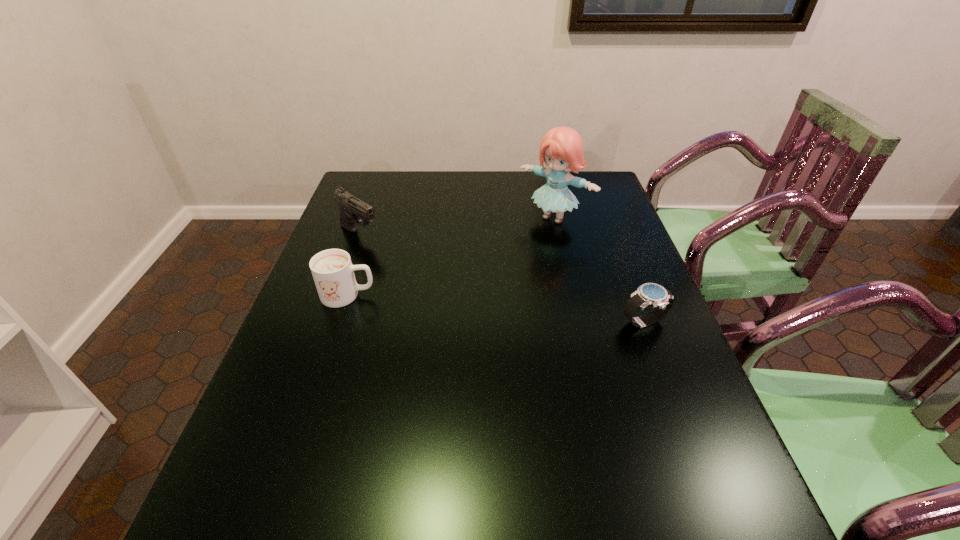
Find the location of `vacant space on the desktop that is between the third farthest object and the watch and is positioned on the front-facing side of the doll`. vacant space on the desktop that is between the third farthest object and the watch and is positioned on the front-facing side of the doll is located at coordinates (466, 306).

Find the location of `vacant space on the desktop that is between the cappuccino and the nearest object and is positioned at the barrel of the pistol`. vacant space on the desktop that is between the cappuccino and the nearest object and is positioned at the barrel of the pistol is located at coordinates (465, 306).